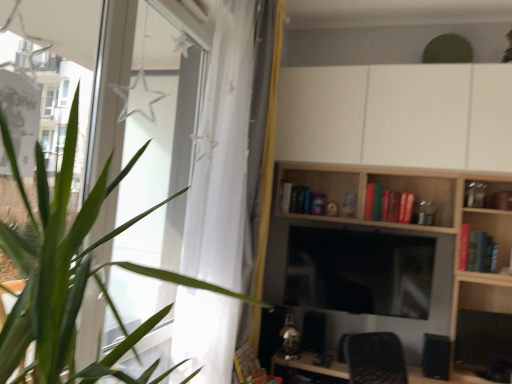
You are a GUI agent. You are given a task and a screenshot of the screen. Output one action in this format:
    pyautogui.click(x=<x>, y=<y>)
    Task: Click on the hardcover book at upper center, acting as the 1th book starting from the back
    The image size is (512, 384).
    Given the screenshot: What is the action you would take?
    pyautogui.click(x=301, y=200)

The image size is (512, 384). What do you see at coordinates (369, 201) in the screenshot?
I see `green matte book at upper center, which is the second book from right to left` at bounding box center [369, 201].

What do you see at coordinates (397, 116) in the screenshot? I see `white matte cabinet at upper center` at bounding box center [397, 116].

This screenshot has width=512, height=384. What are the coordinates of `matte black monitor at center` in the screenshot? It's located at (359, 271).

Are hardcover book at upper center, acting as the 1th book starting from the back, and matte black monitor at center located far from each other?

No, there isn't a large distance between hardcover book at upper center, acting as the 1th book starting from the back, and matte black monitor at center.

Based on their positions, is hardcover book at upper center, which ranks as the third book in right-to-left order, located to the left or right of matte black monitor at center?

Clearly, hardcover book at upper center, which ranks as the third book in right-to-left order, is on the left of matte black monitor at center in the image.

From the image's perspective, is hardcover book at upper center, acting as the 1th book starting from the back, above or below matte black monitor at center?

hardcover book at upper center, acting as the 1th book starting from the back, is above matte black monitor at center.

From the picture: Is white matte cabinet at upper center placed right next to green matte book at upper center, the second book when ordered from front to back?

They are not placed beside each other.

Who is shorter, white matte cabinet at upper center or green matte book at upper center, positioned as the second book in back-to-front order?

green matte book at upper center, positioned as the second book in back-to-front order.

Which is less distant, (x=281, y=151) or (x=374, y=190)?

Point (x=281, y=151).

Does white sheer curtain at left contain white matte cabinet at upper center?

No, white sheer curtain at left does not contain white matte cabinet at upper center.

Based on the photo, could you tell me if white sheer curtain at left is facing white matte cabinet at upper center?

No.

Measure the distance between white sheer curtain at left and white matte cabinet at upper center.

white sheer curtain at left and white matte cabinet at upper center are 37.58 inches apart.

From the image's perspective, which object appears higher, white sheer curtain at left or white matte cabinet at upper center?

white matte cabinet at upper center, from the image's perspective.

Is there a large distance between white matte cabinet at upper center and light wood shelf at center?

That's not correct — white matte cabinet at upper center is a little close to light wood shelf at center.

From a real-world perspective, which object rests below the other?

light wood shelf at center.

Considering the sizes of white matte cabinet at upper center and light wood shelf at center in the image, is white matte cabinet at upper center taller or shorter than light wood shelf at center?

In the image, white matte cabinet at upper center appears to be shorter than light wood shelf at center.

From the image's perspective, is hardcover book at center, which is the 3th book from left to right, located above or below matte black monitor at center?

hardcover book at center, which is the 3th book from left to right, is above matte black monitor at center.

Could you measure the distance between hardcover book at center, the first book viewed from the front, and matte black monitor at center?

They are 20.97 inches apart.

Would you say hardcover book at center, which is the 3th book from left to right, is inside or outside matte black monitor at center?

hardcover book at center, which is the 3th book from left to right, lies outside matte black monitor at center.

Considering the sizes of hardcover book at center, placed as the third book when sorted from back to front, and matte black monitor at center in the image, is hardcover book at center, placed as the third book when sorted from back to front, bigger or smaller than matte black monitor at center?

hardcover book at center, placed as the third book when sorted from back to front, is smaller than matte black monitor at center.

Looking at their sizes, would you say white sheer curtain at left is wider or thinner than green leafy plant at left?

white sheer curtain at left is thinner than green leafy plant at left.

From their relative heights in the image, would you say white sheer curtain at left is taller or shorter than green leafy plant at left?

In the image, white sheer curtain at left appears to be taller than green leafy plant at left.

From a real-world perspective, which object rests below the other?

In real-world perspective, green leafy plant at left is lower.

From the image's perspective, is white sheer curtain at left on green leafy plant at left?

Yes.

Is hardcover book at center, placed as the third book when sorted from back to front, at the right side of white matte cabinet at upper center?

Yes.

Is white matte cabinet at upper center a part of hardcover book at center, the first book in the right-to-left sequence?

Definitely not — white matte cabinet at upper center is not inside hardcover book at center, the first book in the right-to-left sequence.

Consider the image. Is white matte cabinet at upper center at the back of hardcover book at center, the first book viewed from the front?

No, white matte cabinet at upper center is not at the back of hardcover book at center, the first book viewed from the front.

Where is `the 3rd book above the matte black monitor at center (from the image's perspective)`? the 3rd book above the matte black monitor at center (from the image's perspective) is located at coordinates (301, 200).

Locate an element on the screen. The width and height of the screenshot is (512, 384). cabinetry in front of the green matte book at upper center, positioned as the second book in back-to-front order is located at coordinates (397, 116).

Considering their positions, is matte black monitor at center positioned further to green leafy plant at left than hardcover book at center, the first book in the right-to-left sequence?

hardcover book at center, the first book in the right-to-left sequence, lies further to green leafy plant at left than the other object.

When comparing their distances from matte black monitor at center, does green leafy plant at left or green matte book at upper center, which is the second book from right to left, seem closer?

The object closer to matte black monitor at center is green matte book at upper center, which is the second book from right to left.

Which object lies nearer to the anchor point matte black monitor at center, white sheer curtain at left or hardcover book at upper center, the 1th book positioned from the left?

Among the two, hardcover book at upper center, the 1th book positioned from the left, is located nearer to matte black monitor at center.

Which object lies nearer to the anchor point hardcover book at center, the first book viewed from the front, light wood shelf at center or green matte book at upper center, the second book when ordered from front to back?

light wood shelf at center is positioned closer to the anchor hardcover book at center, the first book viewed from the front.

Considering their positions, is light wood shelf at center positioned closer to hardcover book at center, placed as the third book when sorted from back to front, than green leafy plant at left?

light wood shelf at center is positioned closer to the anchor hardcover book at center, placed as the third book when sorted from back to front.

Looking at this image, based on their spatial positions, is light wood shelf at center or matte black monitor at center closer to hardcover book at upper center, the 1th book positioned from the left?

matte black monitor at center.

Which object lies nearer to the anchor point green matte book at upper center, the second book positioned from the left, matte black monitor at center or light wood shelf at center?

matte black monitor at center is positioned closer to the anchor green matte book at upper center, the second book positioned from the left.

Considering their positions, is hardcover book at upper center, marked as the 3th book in a front-to-back arrangement, positioned closer to matte black monitor at center than hardcover book at center, placed as the third book when sorted from back to front?

hardcover book at upper center, marked as the 3th book in a front-to-back arrangement, is positioned closer to the anchor matte black monitor at center.

The image size is (512, 384). I want to click on curtain between green leafy plant at left and matte black monitor at center from front to back, so click(222, 153).

Locate an element on the screen. The height and width of the screenshot is (384, 512). book between matte black monitor at center and hardcover book at center, placed as the third book when sorted from back to front is located at coordinates (369, 201).

The height and width of the screenshot is (384, 512). What are the coordinates of `cabinetry between green leafy plant at left and matte black monitor at center along the z-axis` in the screenshot? It's located at (397, 116).

Find the location of a particular element. This screenshot has width=512, height=384. book situated between hardcover book at upper center, marked as the 3th book in a front-to-back arrangement, and hardcover book at center, placed as the third book when sorted from back to front, from left to right is located at coordinates (369, 201).